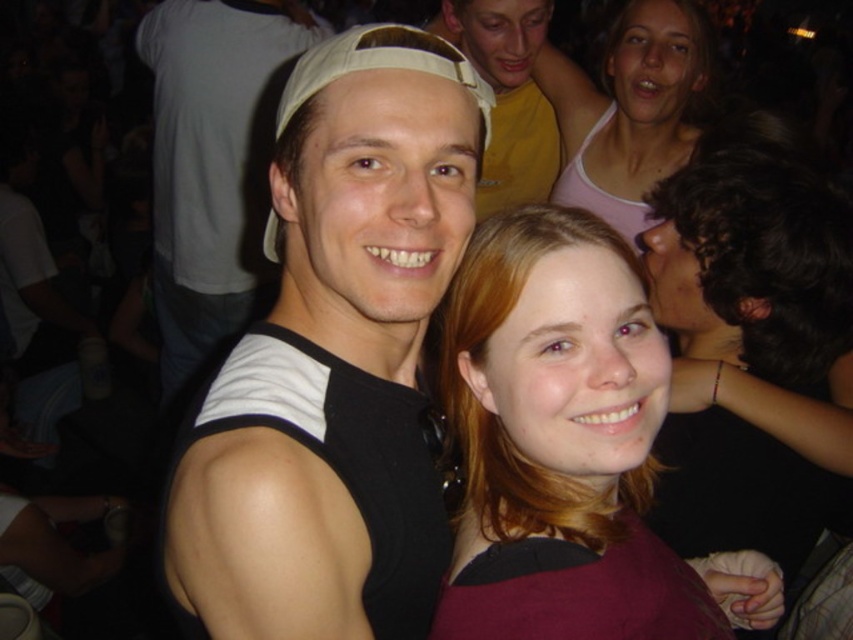
You are a photographer at the event and need to capture a group photo that includes both the pink cotton tank top at upper right and the yellow matte shirt at upper center. Given the camera you have can focus on objects within a 8 inch range, will you be able to include both in the same focused shot?

The distance between the pink cotton tank top at upper right and the yellow matte shirt at upper center is 7.71 inches, which is within the 8 inch range of the camera. Therefore, both can be included in the same focused shot.

You are at a party and want to take a selfie with two friends. The point where you should stand is marked as point (x=492, y=314). If you need to be exactly 28 inches away from that point to get a perfect shot, can you stand there?

The distance of point (x=492, y=314) from viewer is 27.36 inches, so you cannot stand there because it is slightly closer than the required 28 inches for the perfect shot.